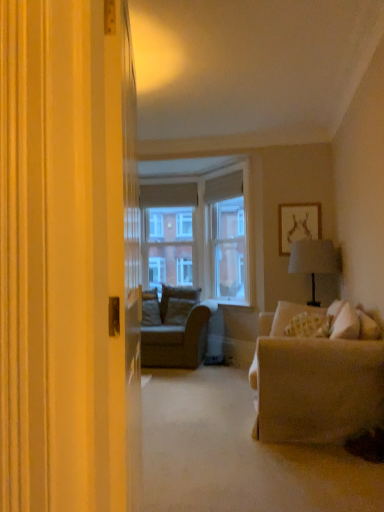
Describe the element at coordinates (227, 234) in the screenshot. I see `clear glass window screen at center, acting as the second window screen starting from the left` at that location.

Identify the location of white matte picture frame at upper right. This screenshot has height=512, width=384. (298, 224).

The height and width of the screenshot is (512, 384). Describe the element at coordinates (298, 224) in the screenshot. I see `white matte picture frame at upper right` at that location.

This screenshot has height=512, width=384. Describe the element at coordinates (290, 315) in the screenshot. I see `patterned fabric pillow at right, positioned as the first pillow in front-to-back order` at that location.

Image resolution: width=384 pixels, height=512 pixels. In order to click on textured beige couch at center in this screenshot , I will do `click(174, 327)`.

The width and height of the screenshot is (384, 512). Identify the location of clear glass window screen at center, which is the 2th window screen from back to front. (227, 234).

Where is `pillow that is the 1st one below the clear glass window screen at center, the first window screen from the right (from a real-world perspective)`? Image resolution: width=384 pixels, height=512 pixels. pillow that is the 1st one below the clear glass window screen at center, the first window screen from the right (from a real-world perspective) is located at coordinates (177, 303).

Is clear glass window screen at center, the first window screen from the right, oriented away from suede cushion at center, which is counted as the 2th pillow, starting from the front?

No, suede cushion at center, which is counted as the 2th pillow, starting from the front, is not at the back of clear glass window screen at center, the first window screen from the right.

Who is shorter, clear glass window screen at center, placed as the 1th window screen when sorted from front to back, or suede cushion at center, marked as the 2th pillow in a right-to-left arrangement?

Standing shorter between the two is suede cushion at center, marked as the 2th pillow in a right-to-left arrangement.

In terms of height, does clear glass window screen at center, placed as the 1th window screen when sorted from front to back, look taller or shorter compared to textured beige couch at center?

In the image, clear glass window screen at center, placed as the 1th window screen when sorted from front to back, appears to be taller than textured beige couch at center.

Is clear glass window screen at center, acting as the second window screen starting from the left, beside textured beige couch at center?

There is a gap between clear glass window screen at center, acting as the second window screen starting from the left, and textured beige couch at center.

Would you say clear glass window screen at center, which is the 2th window screen from back to front, is inside or outside textured beige couch at center?

clear glass window screen at center, which is the 2th window screen from back to front, is located beyond the bounds of textured beige couch at center.

From the image's perspective, relative to textured beige couch at center, is clear glass window screen at center, the first window screen from the right, above or below?

Clearly, from the image's perspective, clear glass window screen at center, the first window screen from the right, is above textured beige couch at center.

From the image's perspective, is white matte picture frame at upper right on top of suede cushion at center, the 1th pillow when ordered from back to front?

Indeed, from the image's perspective, white matte picture frame at upper right is shown above suede cushion at center, the 1th pillow when ordered from back to front.

Considering the relative positions of white matte picture frame at upper right and suede cushion at center, the first pillow positioned from the left, in the image provided, is white matte picture frame at upper right in front of suede cushion at center, the first pillow positioned from the left,?

Yes, it is in front of suede cushion at center, the first pillow positioned from the left.

Is white matte picture frame at upper right not within suede cushion at center, marked as the 2th pillow in a right-to-left arrangement?

white matte picture frame at upper right lies outside suede cushion at center, marked as the 2th pillow in a right-to-left arrangement,'s area.

Considering the positions of objects patterned fabric pillow at right, the second pillow viewed from the left, and clear glass window screen at center, acting as the second window screen starting from the left, in the image provided, who is more to the left, patterned fabric pillow at right, the second pillow viewed from the left, or clear glass window screen at center, acting as the second window screen starting from the left,?

clear glass window screen at center, acting as the second window screen starting from the left, is more to the left.

Is patterned fabric pillow at right, positioned as the first pillow in front-to-back order, positioned far away from clear glass window screen at center, acting as the second window screen starting from the left?

patterned fabric pillow at right, positioned as the first pillow in front-to-back order, is positioned a significant distance from clear glass window screen at center, acting as the second window screen starting from the left.

Considering the positions of point (295, 307) and point (228, 292), is point (295, 307) closer or farther from the camera than point (228, 292)?

Clearly, point (295, 307) is closer to the camera than point (228, 292).

Is the position of patterned fabric pillow at right, which is the second pillow from back to front, less distant than that of clear glass window screen at center, the first window screen from the right?

That is True.

Who is more distant, suede cushion at center, marked as the 2th pillow in a right-to-left arrangement, or clear glass window screen at center, placed as the 1th window screen when sorted from front to back?

suede cushion at center, marked as the 2th pillow in a right-to-left arrangement.

Is suede cushion at center, which is counted as the 2th pillow, starting from the front, thinner than clear glass window screen at center, which is the 2th window screen from back to front?

Indeed, suede cushion at center, which is counted as the 2th pillow, starting from the front, has a lesser width compared to clear glass window screen at center, which is the 2th window screen from back to front.

Is suede cushion at center, marked as the 2th pillow in a right-to-left arrangement, completely or partially outside of clear glass window screen at center, the first window screen from the right?

Yes, suede cushion at center, marked as the 2th pillow in a right-to-left arrangement, is not within clear glass window screen at center, the first window screen from the right.

Could you tell me if suede cushion at center, marked as the 2th pillow in a right-to-left arrangement, is turned towards clear glass window screen at center, placed as the 1th window screen when sorted from front to back?

No, suede cushion at center, marked as the 2th pillow in a right-to-left arrangement, is not aimed at clear glass window screen at center, placed as the 1th window screen when sorted from front to back.

From a real-world perspective, which is physically below, suede cushion at center, which is counted as the 2th pillow, starting from the front, or textured beige couch at center?

textured beige couch at center, from a real-world perspective.

Identify the location of the 2nd pillow directly above the textured beige couch at center (from a real-world perspective). (177, 303).

Is suede cushion at center, the first pillow positioned from the left, surrounding textured beige couch at center?

Definitely not — textured beige couch at center is not inside suede cushion at center, the first pillow positioned from the left.

Does suede cushion at center, marked as the 2th pillow in a right-to-left arrangement, have a greater height compared to textured beige couch at center?

No, suede cushion at center, marked as the 2th pillow in a right-to-left arrangement, is not taller than textured beige couch at center.

From a real-world perspective, which object stands above the other?

clear glass window screen at center, acting as the second window screen starting from the left, is physically above.

How far apart are white matte picture frame at upper right and clear glass window screen at center, the first window screen from the right?

The distance of white matte picture frame at upper right from clear glass window screen at center, the first window screen from the right, is 6.47 feet.

Can you confirm if white matte picture frame at upper right is thinner than clear glass window screen at center, the first window screen from the right?

Correct, the width of white matte picture frame at upper right is less than that of clear glass window screen at center, the first window screen from the right.

The image size is (384, 512). In order to click on pillow lying behind the clear glass window screen at center, the first window screen from the right in this screenshot , I will do `click(177, 303)`.

I want to click on the 2nd window screen located above the textured beige couch at center (from a real-world perspective), so 227,234.

When comparing their distances from suede cushion at center, which is counted as the 2th pillow, starting from the front, does patterned fabric pillow at right, positioned as the first pillow in front-to-back order, or white matte picture frame at upper right seem closer?

The object closer to suede cushion at center, which is counted as the 2th pillow, starting from the front, is white matte picture frame at upper right.

Estimate the real-world distances between objects in this image. Which object is further from patterned fabric pillow at right, the second pillow viewed from the left, white matte picture frame at upper right or suede cushion at center, marked as the 2th pillow in a right-to-left arrangement?

suede cushion at center, marked as the 2th pillow in a right-to-left arrangement, lies further to patterned fabric pillow at right, the second pillow viewed from the left, than the other object.

Based on their spatial positions, is clear glass window screen at center, the first window screen from the right, or textured beige couch at center closer to suede cushion at center, marked as the 2th pillow in a right-to-left arrangement?

Based on the image, textured beige couch at center appears to be nearer to suede cushion at center, marked as the 2th pillow in a right-to-left arrangement.

Which object lies nearer to the anchor point textured beige couch at center, white matte picture frame at upper right or clear glass window screen at center, the first window screen from the right?

clear glass window screen at center, the first window screen from the right, lies closer to textured beige couch at center than the other object.

Consider the image. When comparing their distances from white matte picture frame at upper right, does textured beige couch at center or patterned fabric pillow at right, marked as the 1th pillow in a right-to-left arrangement, seem closer?

Among the two, patterned fabric pillow at right, marked as the 1th pillow in a right-to-left arrangement, is located nearer to white matte picture frame at upper right.

Considering their positions, is clear glass window screen at center, the first window screen from the right, positioned further to textured beige couch at center than suede cushion at center, the first pillow positioned from the left?

clear glass window screen at center, the first window screen from the right, lies further to textured beige couch at center than the other object.

Estimate the real-world distances between objects in this image. Which object is further from suede cushion at center, which is counted as the 2th pillow, starting from the front, patterned fabric pillow at right, which is the second pillow from back to front, or textured beige couch at center?

Based on the image, patterned fabric pillow at right, which is the second pillow from back to front, appears to be further to suede cushion at center, which is counted as the 2th pillow, starting from the front.

When comparing their distances from white matte picture frame at upper right, does textured beige couch at center or clear glass window screen at center, acting as the second window screen starting from the left, seem closer?

The object closer to white matte picture frame at upper right is clear glass window screen at center, acting as the second window screen starting from the left.

Where is `picture frame between patterned fabric pillow at right, the second pillow viewed from the left, and clear glass window screen at center, positioned as the second window screen in right-to-left order, along the z-axis`? This screenshot has width=384, height=512. picture frame between patterned fabric pillow at right, the second pillow viewed from the left, and clear glass window screen at center, positioned as the second window screen in right-to-left order, along the z-axis is located at coordinates (298, 224).

Where is `window screen between patterned fabric pillow at right, the second pillow viewed from the left, and suede cushion at center, which is counted as the 2th pillow, starting from the front, in the front-back direction`? This screenshot has height=512, width=384. window screen between patterned fabric pillow at right, the second pillow viewed from the left, and suede cushion at center, which is counted as the 2th pillow, starting from the front, in the front-back direction is located at coordinates (227, 234).

At what (x,y) coordinates should I click in order to perform the action: click on studio couch between patterned fabric pillow at right, which is the second pillow from back to front, and clear glass window screen at center, the second window screen viewed from the front, along the z-axis. Please return your answer as a coordinate pair (x, y). The image size is (384, 512). Looking at the image, I should click on click(174, 327).

This screenshot has width=384, height=512. Find the location of `pillow between textured beige couch at center and patterned fabric pillow at right, the second pillow viewed from the left`. pillow between textured beige couch at center and patterned fabric pillow at right, the second pillow viewed from the left is located at coordinates (x=177, y=303).